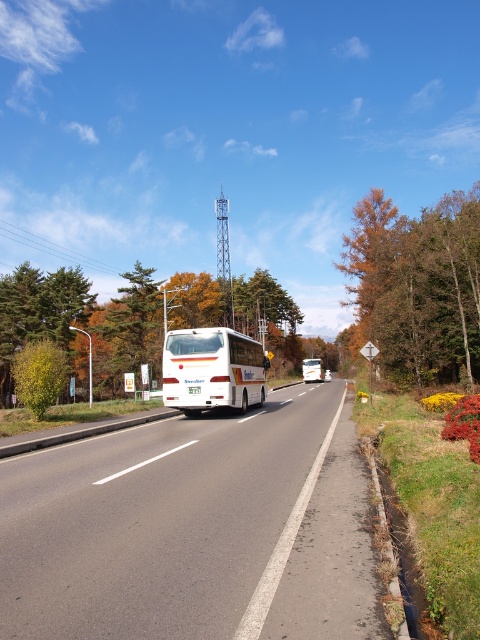
Between white asphalt highway at center and white matte bus at center, which one is positioned lower?

Positioned lower is white matte bus at center.

Does point (45, 524) come in front of point (307, 358)?

Yes, point (45, 524) is in front of point (307, 358).

Where is `white asphalt highway at center`? Image resolution: width=480 pixels, height=640 pixels. white asphalt highway at center is located at coordinates (192, 529).

Is the position of orange matte tree at right less distant than that of white glossy bus at center?

That is False.

Does orange matte tree at right appear on the left side of white glossy bus at center?

No, orange matte tree at right is not to the left of white glossy bus at center.

Is point (443, 294) closer to viewer compared to point (168, 372)?

No, (443, 294) is behind (168, 372).

Locate an element on the screen. orange matte tree at right is located at coordinates (417, 284).

Does point (361, 284) come behind point (322, 368)?

No.

Which is in front, point (441, 365) or point (320, 358)?

Point (441, 365) is more forward.

The width and height of the screenshot is (480, 640). What do you see at coordinates (417, 284) in the screenshot? I see `orange matte tree at right` at bounding box center [417, 284].

The width and height of the screenshot is (480, 640). Find the location of `orange matte tree at right`. orange matte tree at right is located at coordinates (417, 284).